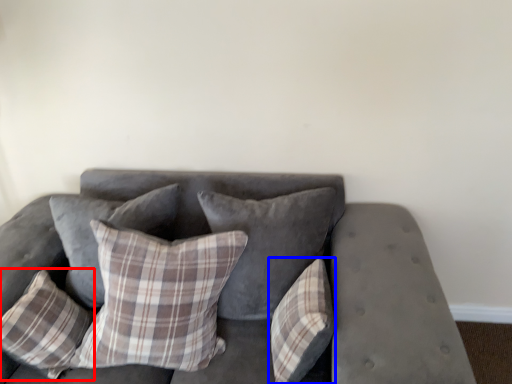
Question: Which object appears farthest to the camera in this image, pillow (highlighted by a red box) or pillow (highlighted by a blue box)?

Choices:
 (A) pillow
 (B) pillow

Answer: (A)